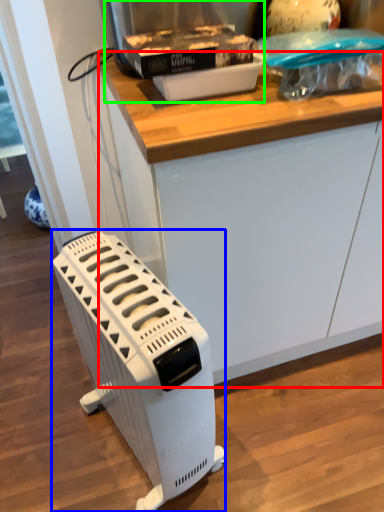
Question: Which object is positioned closest to counter (highlighted by a red box)? Select from home appliance (highlighted by a blue box) and appliance (highlighted by a green box).

Choices:
 (A) home appliance
 (B) appliance

Answer: (B)